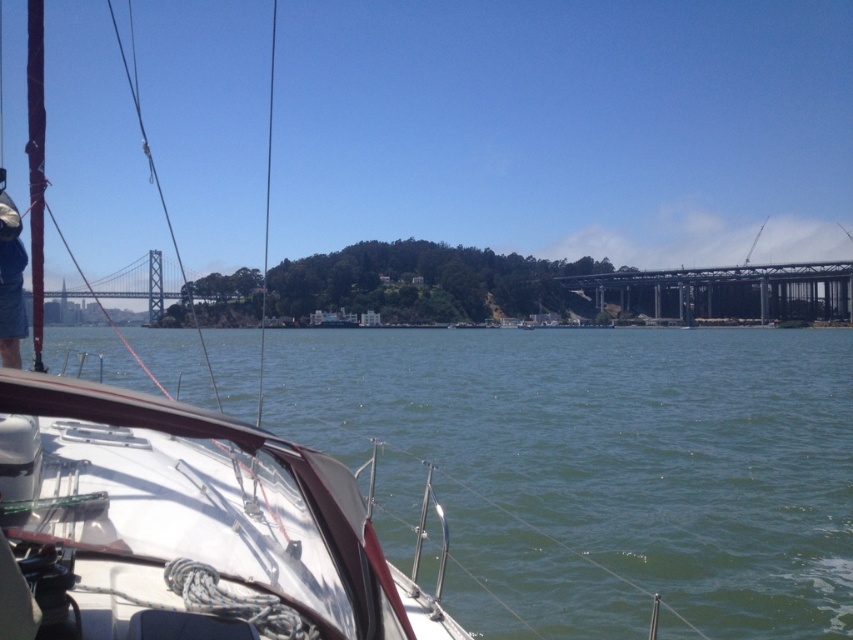
This screenshot has width=853, height=640. What do you see at coordinates (599, 468) in the screenshot? I see `green water at lower left` at bounding box center [599, 468].

Between green water at lower left and white matte boat at lower left, which one appears on the left side from the viewer's perspective?

From the viewer's perspective, green water at lower left appears more on the left side.

Locate an element on the screen. The image size is (853, 640). green water at lower left is located at coordinates (599, 468).

Between white matte sailboat at left and white matte boat at lower left, which one has more height?

white matte sailboat at left

Is white matte sailboat at left shorter than white matte boat at lower left?

No.

Measure the distance between white matte sailboat at left and camera.

white matte sailboat at left and camera are 2.92 meters apart.

Where is `white matte sailboat at left`? white matte sailboat at left is located at coordinates (184, 528).

Identify the location of metallic steel bridge at center. (727, 291).

Which is in front, point (842, 300) or point (15, 257)?

Point (15, 257)

Is point (828, 300) more distant than point (7, 284)?

That is True.

Find the location of a particular element. This screenshot has height=640, width=853. metallic steel bridge at center is located at coordinates (727, 291).